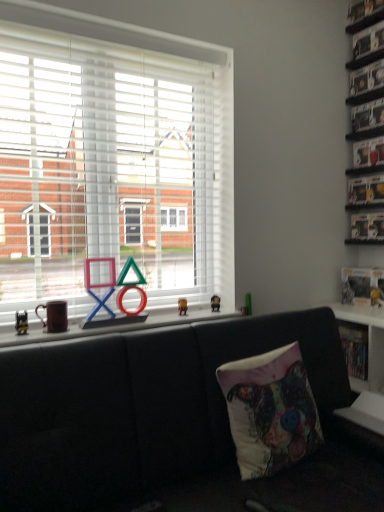
Question: Considering the relative sizes of metallic silver shelf at upper right, the 4th shelf positioned from the bottom, and metallic silver shelf at upper right, the 3th shelf in the top-to-bottom sequence, in the image provided, is metallic silver shelf at upper right, the 4th shelf positioned from the bottom, bigger than metallic silver shelf at upper right, the 3th shelf in the top-to-bottom sequence,?

Choices:
 (A) no
 (B) yes

Answer: (A)

Question: Would you say metallic silver shelf at upper right, acting as the 2th shelf starting from the top, is a long distance from metallic silver shelf at upper right, the 3th shelf in the top-to-bottom sequence?

Choices:
 (A) yes
 (B) no

Answer: (B)

Question: Is metallic silver shelf at upper right, acting as the 2th shelf starting from the top, facing towards metallic silver shelf at upper right, placed as the 3th shelf when sorted from bottom to top?

Choices:
 (A) yes
 (B) no

Answer: (B)

Question: Can you confirm if metallic silver shelf at upper right, acting as the 2th shelf starting from the top, is positioned to the left of metallic silver shelf at upper right, placed as the 3th shelf when sorted from bottom to top?

Choices:
 (A) no
 (B) yes

Answer: (A)

Question: From the image's perspective, does metallic silver shelf at upper right, acting as the 2th shelf starting from the top, appear lower than metallic silver shelf at upper right, the 3th shelf in the top-to-bottom sequence?

Choices:
 (A) no
 (B) yes

Answer: (A)

Question: Which is correct: black leather couch at lower center is inside metallic gold figurine at center, arranged as the first miniature when viewed from the back, or outside of it?

Choices:
 (A) inside
 (B) outside

Answer: (B)

Question: From the image's perspective, is black leather couch at lower center positioned above or below metallic gold figurine at center, which ranks as the second miniature in front-to-back order?

Choices:
 (A) below
 (B) above

Answer: (A)

Question: Looking at their shapes, would you say black leather couch at lower center is wider or thinner than metallic gold figurine at center, which ranks as the second miniature in front-to-back order?

Choices:
 (A) wide
 (B) thin

Answer: (A)

Question: Is black leather couch at lower center taller or shorter than metallic gold figurine at center, which ranks as the second miniature in front-to-back order?

Choices:
 (A) short
 (B) tall

Answer: (B)

Question: From the image's perspective, is metallic gold figurine at center, the 2th miniature positioned from the right, above or below textured fabric pillow at center?

Choices:
 (A) above
 (B) below

Answer: (A)

Question: Is metallic gold figurine at center, positioned as the 1th miniature in left-to-right order, taller or shorter than textured fabric pillow at center?

Choices:
 (A) tall
 (B) short

Answer: (B)

Question: From a real-world perspective, relative to textured fabric pillow at center, is metallic gold figurine at center, the 2th miniature positioned from the right, vertically above or below?

Choices:
 (A) below
 (B) above

Answer: (B)

Question: Considering the positions of metallic gold figurine at center, the 2th miniature positioned from the right, and textured fabric pillow at center in the image, is metallic gold figurine at center, the 2th miniature positioned from the right, wider or thinner than textured fabric pillow at center?

Choices:
 (A) wide
 (B) thin

Answer: (B)

Question: From the image's perspective, is white plastic shelf at lower right, which is the first shelf from bottom to top, located above or below clear plastic shelf at upper right, marked as the 1th shelf in a top-to-bottom arrangement?

Choices:
 (A) above
 (B) below

Answer: (B)

Question: Would you say white plastic shelf at lower right, which is counted as the 5th shelf, starting from the top, is to the left or to the right of clear plastic shelf at upper right, marked as the 1th shelf in a top-to-bottom arrangement, in the picture?

Choices:
 (A) left
 (B) right

Answer: (A)